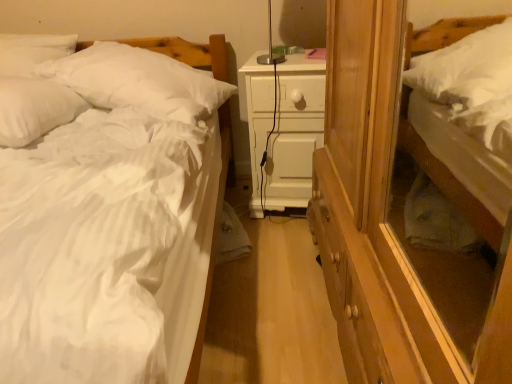
In order to face white soft bed at right, which is counted as the 1th bed, starting from the right, should I rotate leftwards or rightwards?

It's best to rotate right around 21.768 degrees.

What do you see at coordinates (455, 191) in the screenshot?
I see `white soft bed at right, which is counted as the 1th bed, starting from the right` at bounding box center [455, 191].

Locate an element on the screen. Image resolution: width=512 pixels, height=384 pixels. white soft pillow at upper left, which is the second pillow in left-to-right order is located at coordinates (139, 81).

In order to face white matte nightstand at center, should I rotate leftwards or rightwards?

Turn right by 4.187 degrees to look at white matte nightstand at center.

Locate an element on the screen. This screenshot has width=512, height=384. white soft bed at left, which is the second bed in right-to-left order is located at coordinates pos(211,243).

I want to click on white soft bed at right, marked as the 2th bed in a left-to-right arrangement, so click(x=455, y=191).

Is white soft bed at right, which is counted as the 1th bed, starting from the right, not close to white soft pillow at left, which ranks as the 1th pillow in left-to-right order?

Indeed, white soft bed at right, which is counted as the 1th bed, starting from the right, is not near white soft pillow at left, which ranks as the 1th pillow in left-to-right order.

Is white soft bed at right, which is counted as the 1th bed, starting from the right, wider than white soft pillow at left, the second pillow viewed from the right?

In fact, white soft bed at right, which is counted as the 1th bed, starting from the right, might be narrower than white soft pillow at left, the second pillow viewed from the right.

Is white soft bed at right, marked as the 2th bed in a left-to-right arrangement, facing away from white soft pillow at left, which ranks as the 1th pillow in left-to-right order?

No, white soft pillow at left, which ranks as the 1th pillow in left-to-right order, is not at the back of white soft bed at right, marked as the 2th bed in a left-to-right arrangement.

Is white soft bed at right, which is counted as the 1th bed, starting from the right, further to the viewer compared to white soft pillow at left, the second pillow viewed from the right?

That is True.

Can we say white soft bed at right, marked as the 2th bed in a left-to-right arrangement, lies outside white soft bed at left, marked as the 1th bed in a left-to-right arrangement?

That's correct, white soft bed at right, marked as the 2th bed in a left-to-right arrangement, is outside of white soft bed at left, marked as the 1th bed in a left-to-right arrangement.

Does white soft bed at right, which is counted as the 1th bed, starting from the right, touch white soft bed at left, marked as the 1th bed in a left-to-right arrangement?

white soft bed at right, which is counted as the 1th bed, starting from the right, and white soft bed at left, marked as the 1th bed in a left-to-right arrangement, are clearly separated.

Is white soft bed at right, marked as the 2th bed in a left-to-right arrangement, wider than white soft bed at left, marked as the 1th bed in a left-to-right arrangement?

Incorrect, the width of white soft bed at right, marked as the 2th bed in a left-to-right arrangement, does not surpass that of white soft bed at left, marked as the 1th bed in a left-to-right arrangement.

From the image's perspective, is white soft bed at right, marked as the 2th bed in a left-to-right arrangement, above or below white soft bed at left, which is the second bed in right-to-left order?

From the image's perspective, white soft bed at right, marked as the 2th bed in a left-to-right arrangement, appears above white soft bed at left, which is the second bed in right-to-left order.

Measure the distance from white soft bed at left, marked as the 1th bed in a left-to-right arrangement, to white soft bed at right, which is counted as the 1th bed, starting from the right.

34.69 inches.

Does point (208, 221) lie in front of point (485, 239)?

Yes.

Considering the relative positions of white soft bed at left, which is the second bed in right-to-left order, and white soft bed at right, which is counted as the 1th bed, starting from the right, in the image provided, is white soft bed at left, which is the second bed in right-to-left order, to the left of white soft bed at right, which is counted as the 1th bed, starting from the right, from the viewer's perspective?

Yes, white soft bed at left, which is the second bed in right-to-left order, is to the left of white soft bed at right, which is counted as the 1th bed, starting from the right.

Does white soft bed at left, marked as the 1th bed in a left-to-right arrangement, turn towards white soft bed at right, marked as the 2th bed in a left-to-right arrangement?

No, white soft bed at left, marked as the 1th bed in a left-to-right arrangement, does not turn towards white soft bed at right, marked as the 2th bed in a left-to-right arrangement.

Is white soft pillow at left, the second pillow viewed from the right, placed right next to white matte nightstand at center?

No.

Is white soft pillow at left, the second pillow viewed from the right, aimed at white matte nightstand at center?

No, white soft pillow at left, the second pillow viewed from the right, is not turned towards white matte nightstand at center.

At what (x,y) coordinates should I click in order to perform the action: click on the 2nd pillow to the left of the white matte nightstand at center, starting your count from the anchor. Please return your answer as a coordinate pair (x, y). This screenshot has width=512, height=384. Looking at the image, I should click on (34, 108).

What's the angular difference between white soft pillow at left, which ranks as the 1th pillow in left-to-right order, and white matte nightstand at center's facing directions?

They differ by 1.51 degrees in their facing directions.

Does point (288, 130) come farther from viewer compared to point (27, 80)?

That is True.

Which object is positioned more to the left, white matte nightstand at center or white soft pillow at left, which ranks as the 1th pillow in left-to-right order?

white soft pillow at left, which ranks as the 1th pillow in left-to-right order.

How different are the orientations of white matte nightstand at center and white soft pillow at left, the second pillow viewed from the right, in degrees?

The angle between the facing direction of white matte nightstand at center and the facing direction of white soft pillow at left, the second pillow viewed from the right, is 1.51 degrees.

From the image's perspective, is white matte nightstand at center over white soft pillow at left, the second pillow viewed from the right?

No, from the image's perspective, white matte nightstand at center is not on top of white soft pillow at left, the second pillow viewed from the right.

Does point (280, 204) lie behind point (468, 215)?

Yes, point (280, 204) is farther from viewer.

Which object is positioned more to the right, white matte nightstand at center or white soft bed at right, which is counted as the 1th bed, starting from the right?

white soft bed at right, which is counted as the 1th bed, starting from the right.

Is white matte nightstand at center next to white soft bed at right, marked as the 2th bed in a left-to-right arrangement?

No, white matte nightstand at center is not making contact with white soft bed at right, marked as the 2th bed in a left-to-right arrangement.

From a real-world perspective, is white soft pillow at upper left, placed as the first pillow when sorted from right to left, physically below white soft bed at right, marked as the 2th bed in a left-to-right arrangement?

No.

Would you consider white soft pillow at upper left, which is the second pillow in left-to-right order, to be distant from white soft bed at right, marked as the 2th bed in a left-to-right arrangement?

Yes, white soft pillow at upper left, which is the second pillow in left-to-right order, and white soft bed at right, marked as the 2th bed in a left-to-right arrangement, are located far from each other.

Can white soft bed at right, marked as the 2th bed in a left-to-right arrangement, be found inside white soft pillow at upper left, placed as the first pillow when sorted from right to left?

No, white soft bed at right, marked as the 2th bed in a left-to-right arrangement, is not inside white soft pillow at upper left, placed as the first pillow when sorted from right to left.

In terms of height, does white soft pillow at upper left, placed as the first pillow when sorted from right to left, look taller or shorter compared to white soft bed at right, which is counted as the 1th bed, starting from the right?

In the image, white soft pillow at upper left, placed as the first pillow when sorted from right to left, appears to be shorter than white soft bed at right, which is counted as the 1th bed, starting from the right.

Identify the location of bed behind the white soft pillow at left, the second pillow viewed from the right. (455, 191).

What are the coordinates of `bed located above the white soft bed at left, marked as the 1th bed in a left-to-right arrangement (from the image's perspective)` in the screenshot? It's located at (455, 191).

Based on their spatial positions, is white soft pillow at left, which ranks as the 1th pillow in left-to-right order, or white matte nightstand at center closer to white soft bed at left, marked as the 1th bed in a left-to-right arrangement?

white matte nightstand at center lies closer to white soft bed at left, marked as the 1th bed in a left-to-right arrangement, than the other object.

Looking at the image, which one is located further to white soft bed at right, marked as the 2th bed in a left-to-right arrangement, white soft pillow at left, the second pillow viewed from the right, or white matte nightstand at center?

white soft pillow at left, the second pillow viewed from the right.

When comparing their distances from white soft pillow at left, the second pillow viewed from the right, does white matte nightstand at center or white soft pillow at upper left, placed as the first pillow when sorted from right to left, seem closer?

white soft pillow at upper left, placed as the first pillow when sorted from right to left, lies closer to white soft pillow at left, the second pillow viewed from the right, than the other object.

Looking at the image, which one is located closer to white soft pillow at left, which ranks as the 1th pillow in left-to-right order, white soft bed at right, which is counted as the 1th bed, starting from the right, or white matte nightstand at center?

white matte nightstand at center is positioned closer to the anchor white soft pillow at left, which ranks as the 1th pillow in left-to-right order.

Looking at the image, which one is located closer to white soft bed at right, which is counted as the 1th bed, starting from the right, white soft pillow at upper left, which is the second pillow in left-to-right order, or white soft bed at left, which is the second bed in right-to-left order?

white soft bed at left, which is the second bed in right-to-left order, is positioned closer to the anchor white soft bed at right, which is counted as the 1th bed, starting from the right.

Which object lies nearer to the anchor point white soft bed at left, marked as the 1th bed in a left-to-right arrangement, white soft bed at right, which is counted as the 1th bed, starting from the right, or white matte nightstand at center?

white matte nightstand at center.

Looking at the image, which one is located further to white soft pillow at upper left, placed as the first pillow when sorted from right to left, white soft bed at right, which is counted as the 1th bed, starting from the right, or white soft pillow at left, which ranks as the 1th pillow in left-to-right order?

white soft bed at right, which is counted as the 1th bed, starting from the right, is positioned further to the anchor white soft pillow at upper left, placed as the first pillow when sorted from right to left.

Consider the image. From the image, which object appears to be farther from white soft bed at left, which is the second bed in right-to-left order, white matte nightstand at center or white soft pillow at upper left, which is the second pillow in left-to-right order?

The object further to white soft bed at left, which is the second bed in right-to-left order, is white matte nightstand at center.

Identify the location of pillow between white soft pillow at left, which ranks as the 1th pillow in left-to-right order, and white soft bed at right, marked as the 2th bed in a left-to-right arrangement. The image size is (512, 384). (139, 81).

In order to click on pillow positioned between white soft bed at left, which is the second bed in right-to-left order, and white soft pillow at upper left, which is the second pillow in left-to-right order, from near to far in this screenshot , I will do `click(34, 108)`.

The width and height of the screenshot is (512, 384). What are the coordinates of `nightstand between white soft pillow at left, the second pillow viewed from the right, and white soft bed at right, which is counted as the 1th bed, starting from the right, from left to right` in the screenshot? It's located at (295, 132).

Locate an element on the screen. The width and height of the screenshot is (512, 384). bed situated between white soft pillow at left, the second pillow viewed from the right, and white soft bed at right, which is counted as the 1th bed, starting from the right, from left to right is located at coordinates (211, 243).